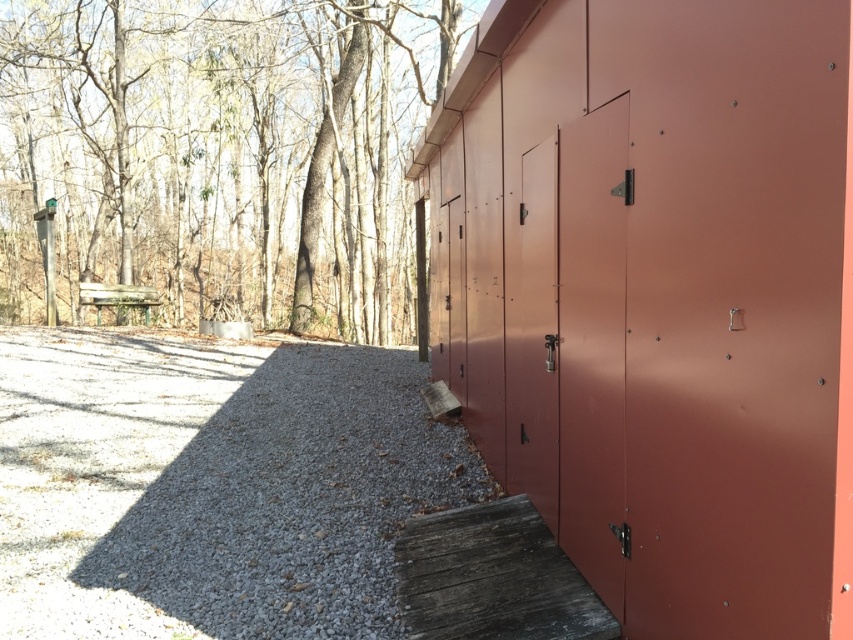
You are standing at the entrance of the gravel pathway and want to take a photo of the bare wood tree at upper left. If your camera can focus on objects up to 10 meters away, will it be able to capture the tree clearly?

The distance of the bare wood tree at upper left from the camera is 9.17 meters, which is within the camera focus range of up to 10 meters. Therefore, the camera can capture the tree clearly.

You are organizing a storage unit and need to fit a large box into the available space. You have two doors to choose from in the image. Which door, the matte red door at center or the matte metal door at center, would allow the box to be placed through more easily?

The matte metal door at center occupies more space than the matte red door at center, so the matte metal door at center would allow the box to be placed through more easily since it has a larger opening.